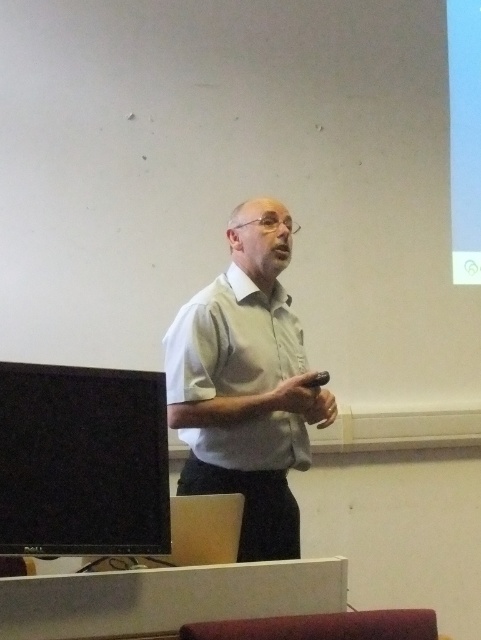
Between light gray shirt at center and black glossy monitor at left, which one is positioned higher?

light gray shirt at center is above.

Is light gray shirt at center below black glossy monitor at left?

No.

Is point (256, 236) farther from viewer compared to point (134, 541)?

That is True.

This screenshot has height=640, width=481. In order to click on light gray shirt at center in this screenshot , I will do `click(245, 385)`.